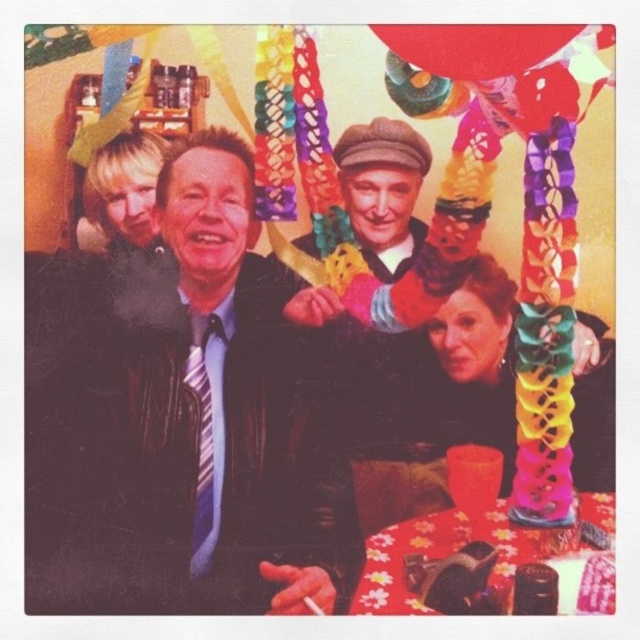
Question: Is leather jacket at center above rubber balloon at upper center?

Choices:
 (A) no
 (B) yes

Answer: (A)

Question: Which object appears closest to the camera in this image?

Choices:
 (A) leather jacket at center
 (B) rubber balloon at upper center

Answer: (B)

Question: Considering the relative positions of leather jacket at center and rubber balloon at upper center in the image provided, where is leather jacket at center located with respect to rubber balloon at upper center?

Choices:
 (A) below
 (B) above

Answer: (A)

Question: Observing the image, what is the correct spatial positioning of leather jacket at center in reference to rubber balloon at upper center?

Choices:
 (A) above
 (B) below

Answer: (B)